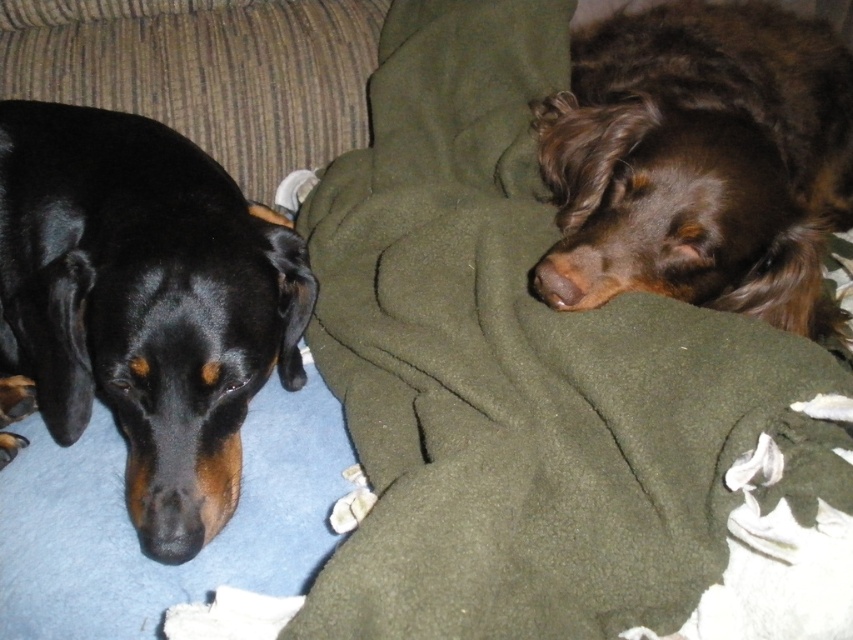
In the scene shown: You are trying to decide whether to place a new pillow on the couch. The pillow is the same size as the black matte dog at left. Will it fit on the green fleece blanket at upper right?

The green fleece blanket at upper right is bigger than the black matte dog at left, so the pillow will fit on the green fleece blanket at upper right.

You are trying to determine if the green fleece blanket at upper right can fully cover the brown fuzzy dog at center. Based on their sizes, what do you think?

The green fleece blanket at upper right might be wider than brown fuzzy dog at center, so it could potentially cover the dog depending on the blanket length and the dog size.

You are a dog owner who wants to place a new toy between the green fleece blanket at upper right and the brown fuzzy dog at center. Based on their positions, where should you place the toy so it is between them?

The green fleece blanket at upper right is in front of the brown fuzzy dog at center, so placing the toy between them would require positioning it in front of the brown fuzzy dog at center but behind the green fleece blanket at upper right.